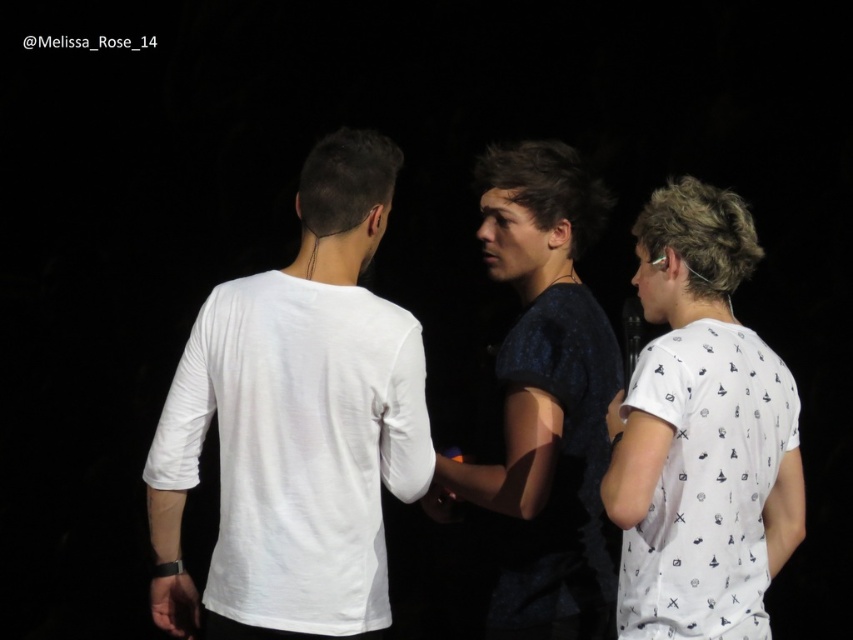
Does white matte t-shirt at center come behind white cotton t-shirt at center?

No, it is not.

Is white matte t-shirt at center smaller than white cotton t-shirt at center?

Incorrect, white matte t-shirt at center is not smaller in size than white cotton t-shirt at center.

Identify the location of white matte t-shirt at center. (314, 428).

Describe the element at coordinates (297, 422) in the screenshot. This screenshot has width=853, height=640. I see `white cotton t-shirt at center` at that location.

Is white cotton t-shirt at center in front of dark blue textured shirt at center?

Yes, white cotton t-shirt at center is closer to the viewer.

You are a GUI agent. You are given a task and a screenshot of the screen. Output one action in this format:
    pyautogui.click(x=<x>, y=<y>)
    Task: Click on the white cotton t-shirt at center
    The image size is (853, 640).
    Given the screenshot: What is the action you would take?
    pyautogui.click(x=297, y=422)

Between point (247, 595) and point (624, 445), which one is positioned behind?

The point (247, 595) is more distant.

Locate an element on the screen. white cotton t-shirt at center is located at coordinates (297, 422).

At what (x,y) coordinates should I click in order to perform the action: click on white cotton t-shirt at center. Please return your answer as a coordinate pair (x, y). The height and width of the screenshot is (640, 853). Looking at the image, I should click on (297, 422).